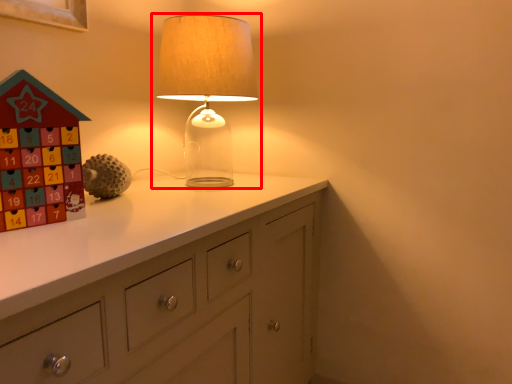
Question: From the image's perspective, what is the correct spatial positioning of lamp (annotated by the red box) in reference to toy?

Choices:
 (A) above
 (B) below

Answer: (A)